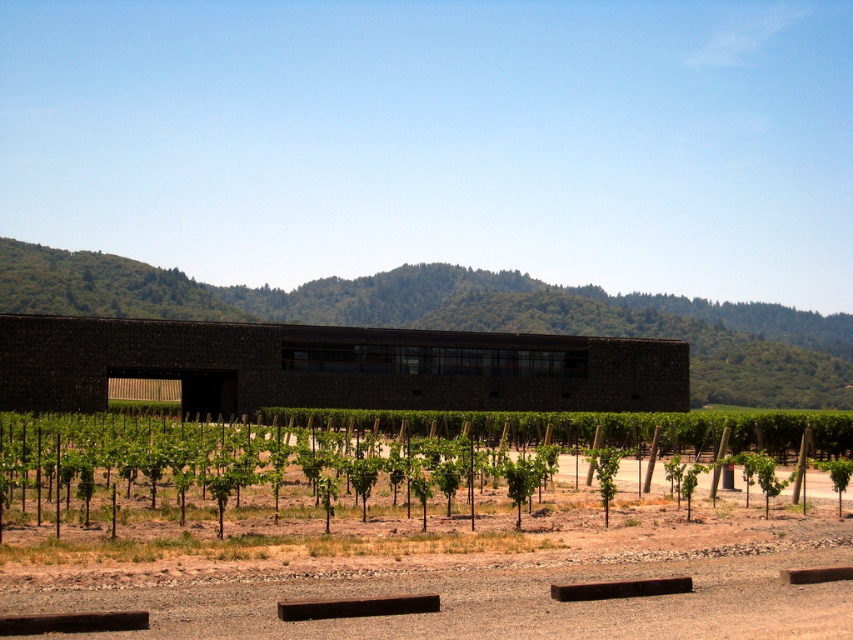
You are a visitor standing at the entrance of the building and want to take a photo of both the green leafy vines at lower center and the green leafy tree at center. Which object should you position yourself closer to in order to capture both in the frame?

You should position yourself closer to the green leafy tree at center because the green leafy vines at lower center is to the left of green leafy tree at center, so by centering the tree, the vines will be included on the left side of the frame.

You are a gardener who wants to plant a new tree in the vineyard. You have two options from the scene, the green leafy vines at lower center and the green leafy tree at center. Which one is taller and should be considered for space planning?

The green leafy vines at lower center are much taller than the green leafy tree at center, so they should be considered for space planning.